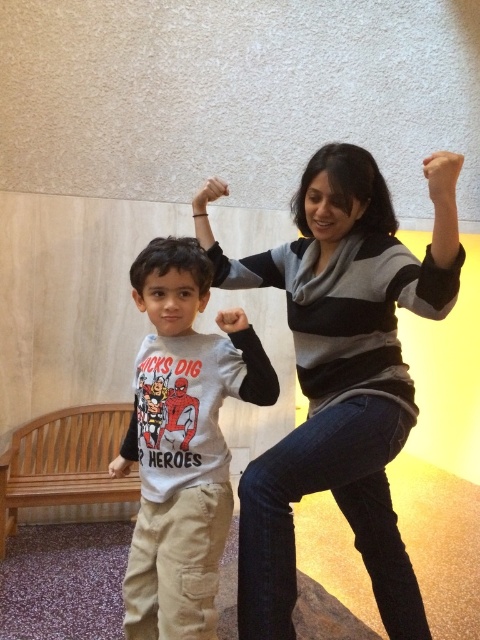
From the picture: You are observing a scene where a boy and another person are interacting. You notice two objects labeled as the matte black sleeve at upper center and the matte black hand at upper center. Based on their positions, which one is closer to the bottom of the image?

The matte black sleeve at upper center is closer to the bottom of the image because it is located below the matte black hand at upper center.

You are a delivery robot with a height of 1.5 meters. You need to deliver a package to the matte black hand at upper center. There is a brown wooden bench at lower left in the way. Can you safely navigate around the bench to reach the hand?

The distance between the brown wooden bench at lower left and the matte black hand at upper center is 2.54 meters. Since the robot is 1.5 meters tall, it can navigate around the bench as long as there is enough horizontal space. However, the provided information only specifies the distance between the two objects, not the available horizontal clearance. Without knowing the exact dimensions of the bench and the path, it is uncertain if the robot can safely maneuver around the bench to reach the hand.